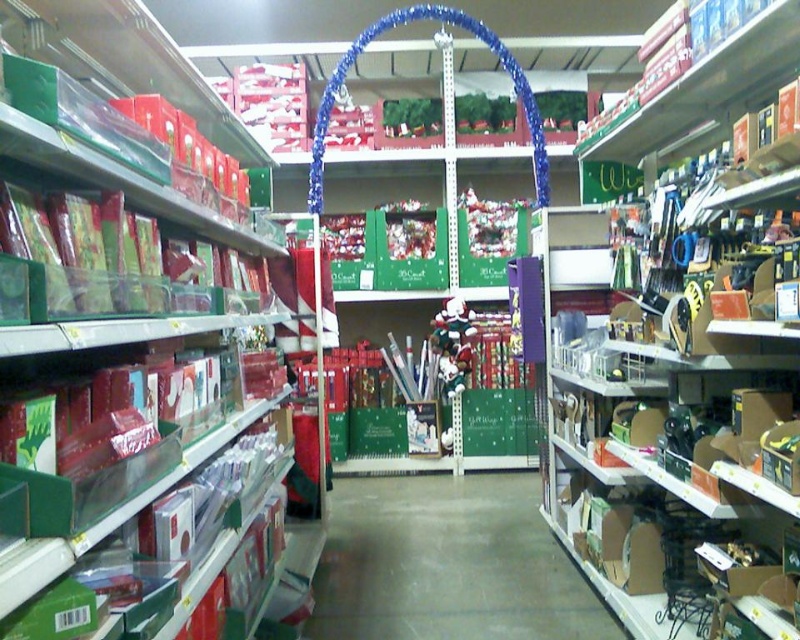
You are a customer in the store and want to pick up both the matte red gift wrap at left and the shiny metallic santa at center. Which item should you reach for first if you want to grab the one closer to you first?

The matte red gift wrap at left is closer to the viewer than the shiny metallic santa at center, so you should reach for the matte red gift wrap at left first.